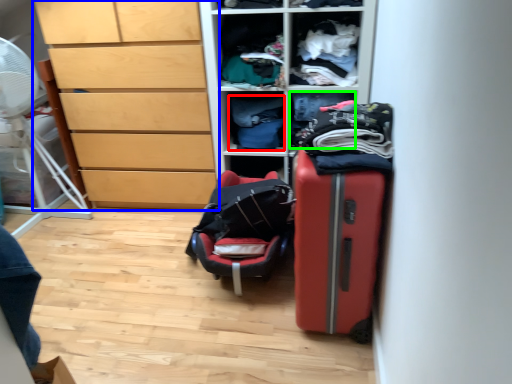
Question: Which is farther away from clothing (highlighted by a red box)? chest of drawers (highlighted by a blue box) or clothing (highlighted by a green box)?

Choices:
 (A) chest of drawers
 (B) clothing

Answer: (A)